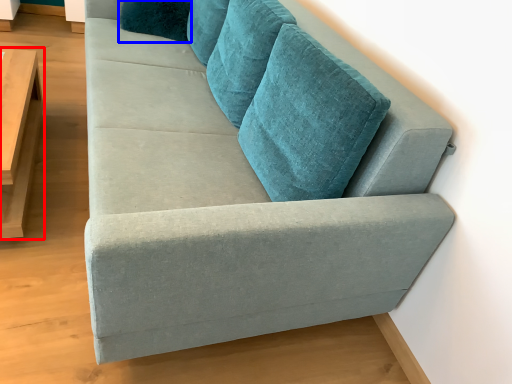
Question: Which object is further to the camera taking this photo, table (highlighted by a red box) or pillow (highlighted by a blue box)?

Choices:
 (A) table
 (B) pillow

Answer: (B)